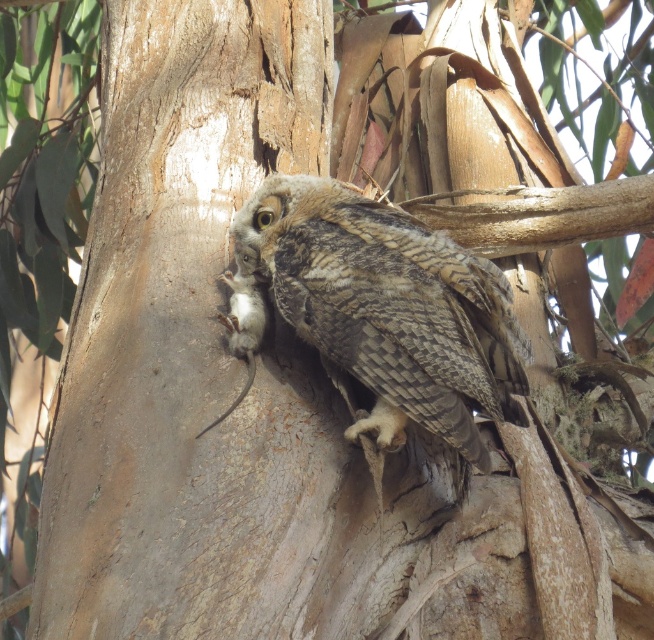
You are standing 2 meters away from a tree trunk. You see the smooth brown bark at center. Can you reach it with your hand?

The smooth brown bark at center is 1.77 meters away from viewer, so yes, you can reach it with your hand since it is within arm length.

Based on the scene, which object is bigger between the smooth brown bark at center and the camouflage feathered owl at center?

The smooth brown bark at center is larger in size compared to the camouflage feathered owl at center.